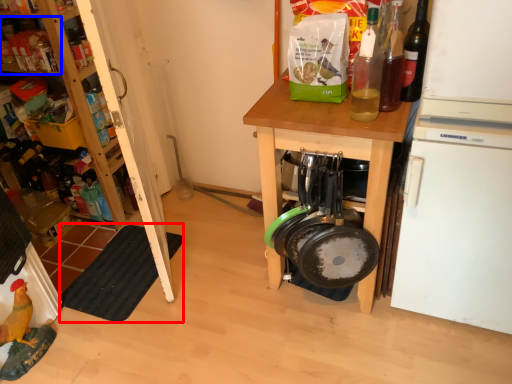
Question: Which of the following is the closest to the observer, mat (highlighted by a red box) or shelf (highlighted by a blue box)?

Choices:
 (A) mat
 (B) shelf

Answer: (A)